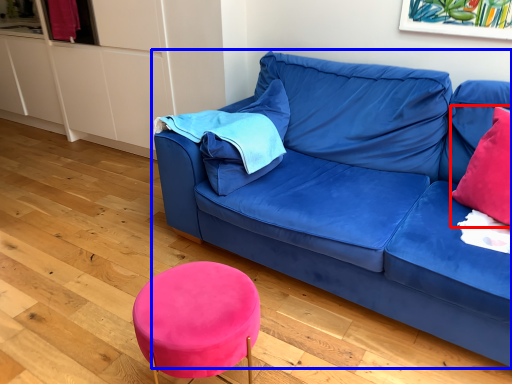
Question: Which object is closer to the camera taking this photo, throw pillow (highlighted by a red box) or studio couch (highlighted by a blue box)?

Choices:
 (A) throw pillow
 (B) studio couch

Answer: (B)